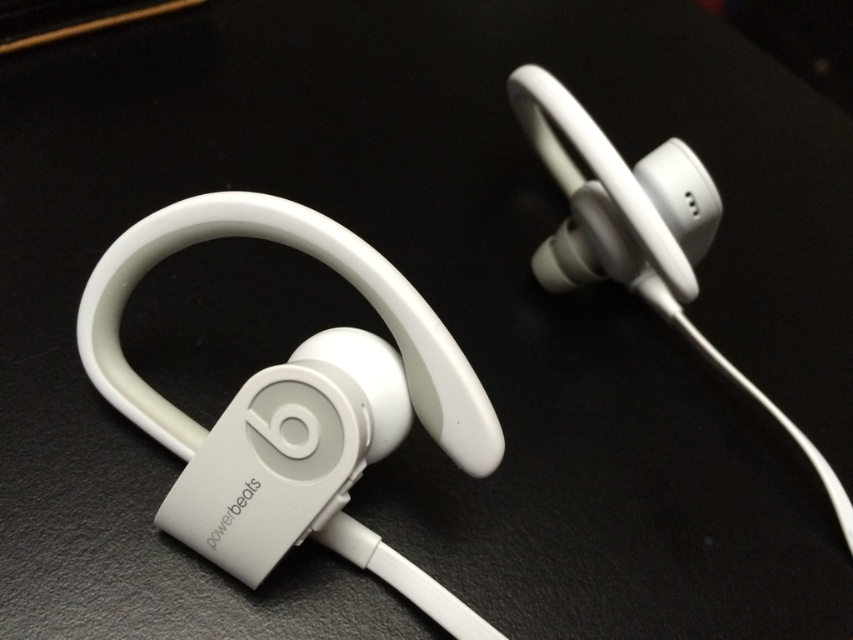
You have a small container that can only hold items up to 1 inch in length. You need to place both the white matte earphone at center and the white matte earphone at upper center into the container. Can both earphones fit inside the container if they are placed side by side?

The white matte earphone at center and the white matte earphone at upper center are 0.64 inches apart. Since the container can hold items up to 1 inch in length, placing them side by side would require a total length of 0.64 inches, which is within the container capacity. Therefore, both earphones can fit inside the container.

You are setting up a display for a tech store and need to arrange the white matte earphone at center and the white matte earphone at upper center. Which earphone should you place in the front to show its design details better?

The white matte earphone at center is thinner than the white matte earphone at upper center, so placing the thinner one in front would allow its design details to be more visible without being obscured by the thicker one.